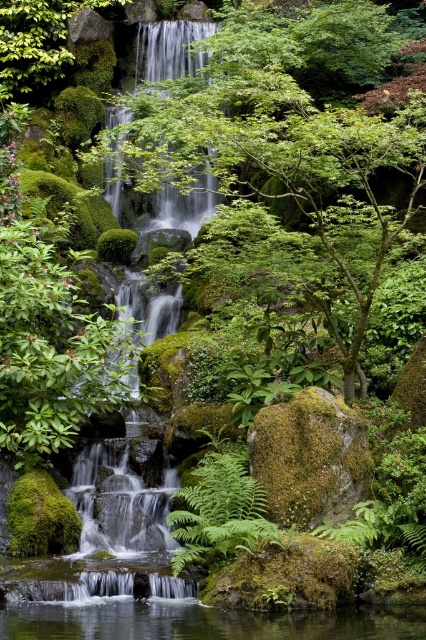
Question: Does green leafy tree at center have a greater width compared to clear water at center?

Choices:
 (A) yes
 (B) no

Answer: (A)

Question: Considering the relative positions of green leafy tree at center and green mossy rock at center in the image provided, where is green leafy tree at center located with respect to green mossy rock at center?

Choices:
 (A) left
 (B) right

Answer: (A)

Question: Which of the following is the closest to the observer?

Choices:
 (A) green mossy rock at center
 (B) clear water at center
 (C) green leafy tree at center
 (D) green leafy fern at center

Answer: (B)

Question: Which of the following is the closest to the observer?

Choices:
 (A) (241, 449)
 (B) (43, 608)
 (C) (305, 438)
 (D) (213, 22)

Answer: (C)

Question: Which of the following is the farthest from the observer?

Choices:
 (A) clear water at center
 (B) green mossy waterfall at upper center
 (C) green leafy fern at center

Answer: (B)

Question: Considering the relative positions of green leafy tree at center and clear water at center in the image provided, where is green leafy tree at center located with respect to clear water at center?

Choices:
 (A) below
 (B) above

Answer: (B)